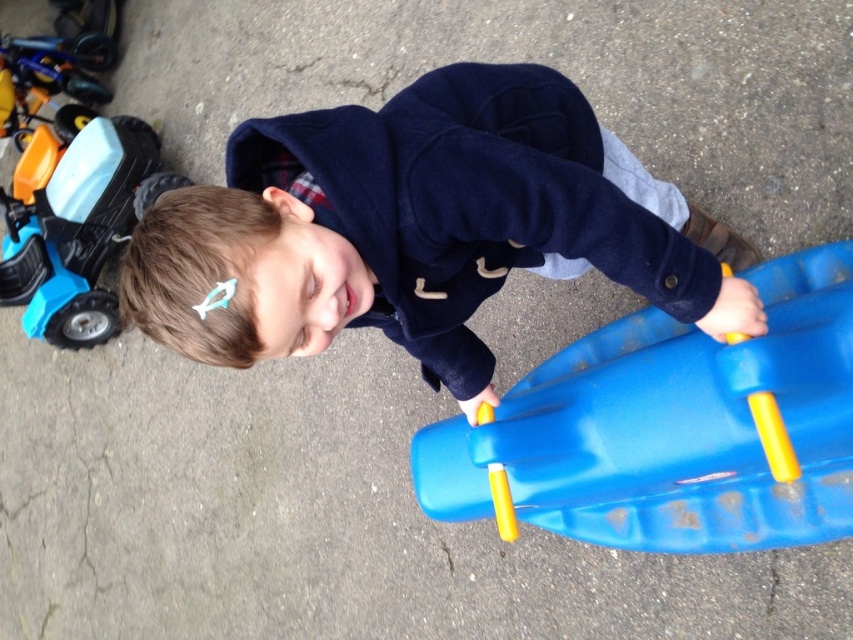
You are a parent trying to locate your child who is playing with a blue plastic sled. The sled is at the center of the image. Based on the coordinates provided, can you determine if the point marked at (671, 428) is where the sled is located?

The point at (671, 428) corresponds to the blue plastic sled at center, so yes, the marked coordinates are where the sled is located.

You are a parent trying to organize your child toys. You have a blue plastic sled at center and a blue plastic toy car at left. Where should you place the sled to keep it safe from being run over by the toy car?

The blue plastic sled at center is below the blue plastic toy car at left, so placing the sled underneath the toy car would keep it safe from being run over.

You are a delivery person standing in front of the matte blue jacket at center. You need to place a small package on the ground near the jacket without stepping closer than 36 inches. Is this possible?

The distance between the matte blue jacket at center and the viewer is 36.16 inches. Since the required minimum distance is 36 inches, you can place the package at exactly 36 inches from the jacket, which is within the allowed range.